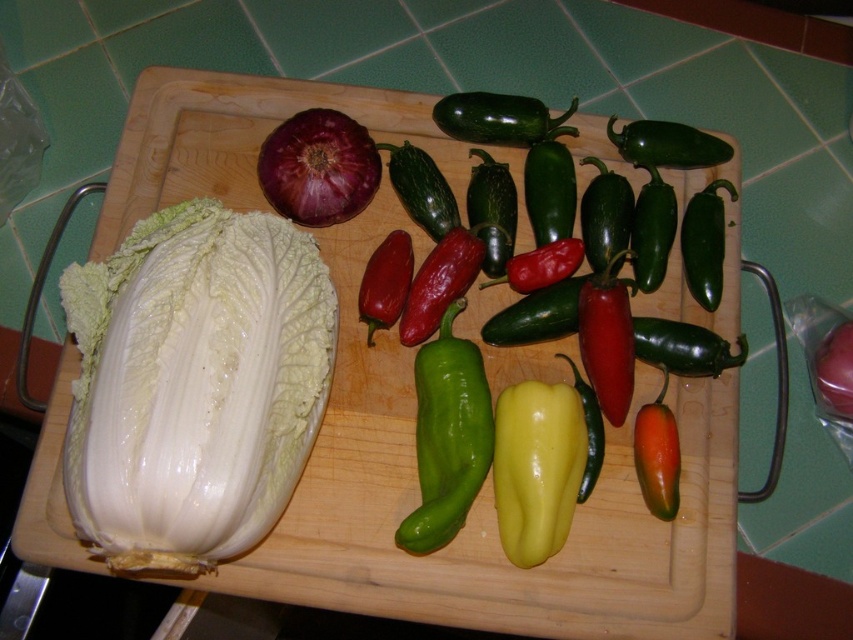
Between point (547, 124) and point (833, 385), which one is positioned behind?

Point (547, 124)

In the scene shown: Does green glossy jalapeño at upper center have a lesser height compared to matte purple onion at upper left?

Yes.

Does point (512, 131) come behind point (837, 356)?

Yes.

The height and width of the screenshot is (640, 853). I want to click on green glossy jalapeño at upper center, so click(x=498, y=118).

Identify the location of green glossy bell pepper at center. (447, 436).

Which is behind, point (416, 424) or point (474, 136)?

The point (474, 136) is behind.

Does point (415, 365) come behind point (490, 141)?

No.

Locate an element on the screen. green glossy bell pepper at center is located at coordinates (447, 436).

Consider the image. Who is higher up, green matte bell pepper at center or matte purple onion at upper left?

matte purple onion at upper left

Does point (650, 480) lie in front of point (839, 349)?

Yes, point (650, 480) is closer to viewer.

Image resolution: width=853 pixels, height=640 pixels. I want to click on green matte bell pepper at center, so click(x=657, y=456).